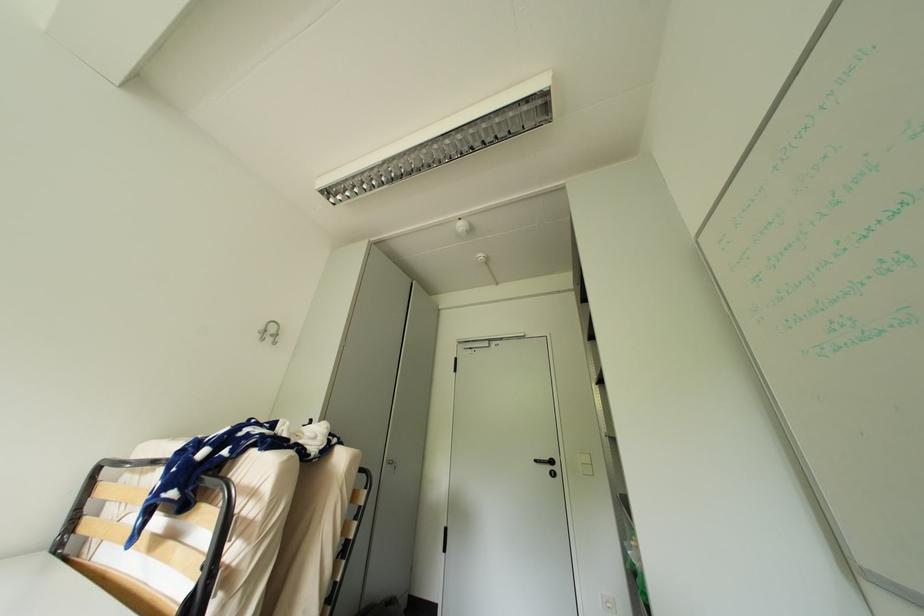
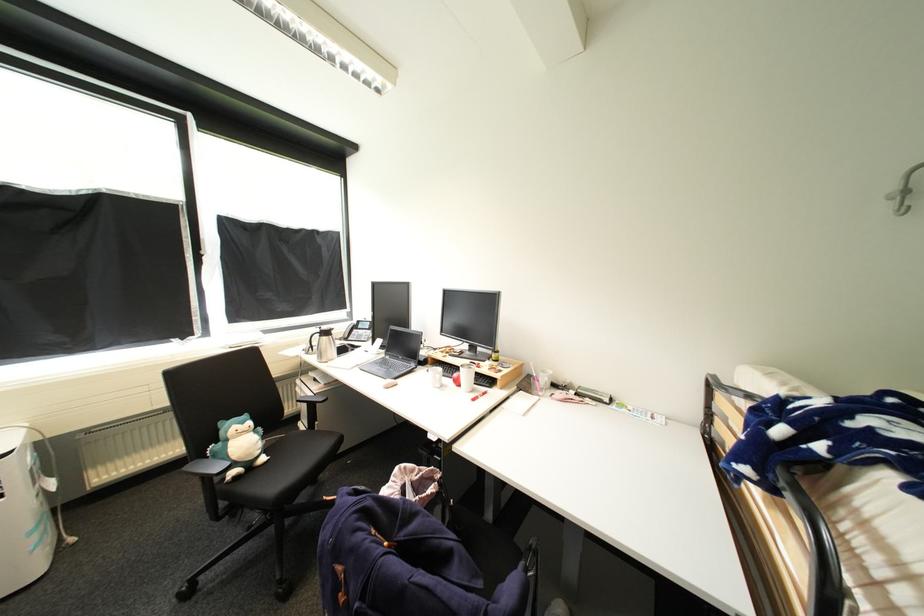
Locate, in the second image, the point that corresponds to (x=265, y=334) in the first image.

(900, 199)